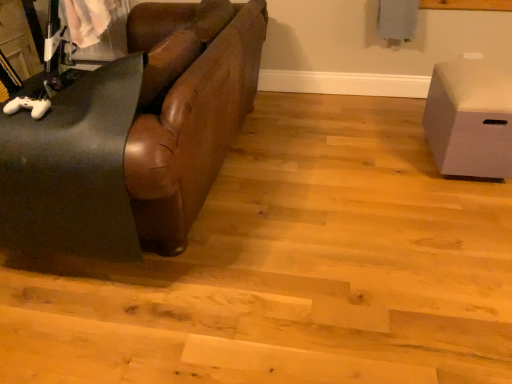
Question: Considering the positions of point (131, 183) and point (510, 145), is point (131, 183) closer or farther from the camera than point (510, 145)?

Choices:
 (A) closer
 (B) farther

Answer: (A)

Question: From a real-world perspective, is brown leather couch at left positioned above or below white matte storage box at right?

Choices:
 (A) above
 (B) below

Answer: (A)

Question: From the image's perspective, relative to white matte storage box at right, is brown leather couch at left above or below?

Choices:
 (A) above
 (B) below

Answer: (A)

Question: Considering the positions of white matte storage box at right and brown leather couch at left in the image, is white matte storage box at right wider or thinner than brown leather couch at left?

Choices:
 (A) wide
 (B) thin

Answer: (B)

Question: In the image, is white matte storage box at right on the left side or the right side of brown leather couch at left?

Choices:
 (A) right
 (B) left

Answer: (A)

Question: From a real-world perspective, is white matte storage box at right positioned above or below brown leather couch at left?

Choices:
 (A) above
 (B) below

Answer: (B)

Question: Considering their positions, is white matte storage box at right located in front of or behind brown leather couch at left?

Choices:
 (A) behind
 (B) front

Answer: (A)